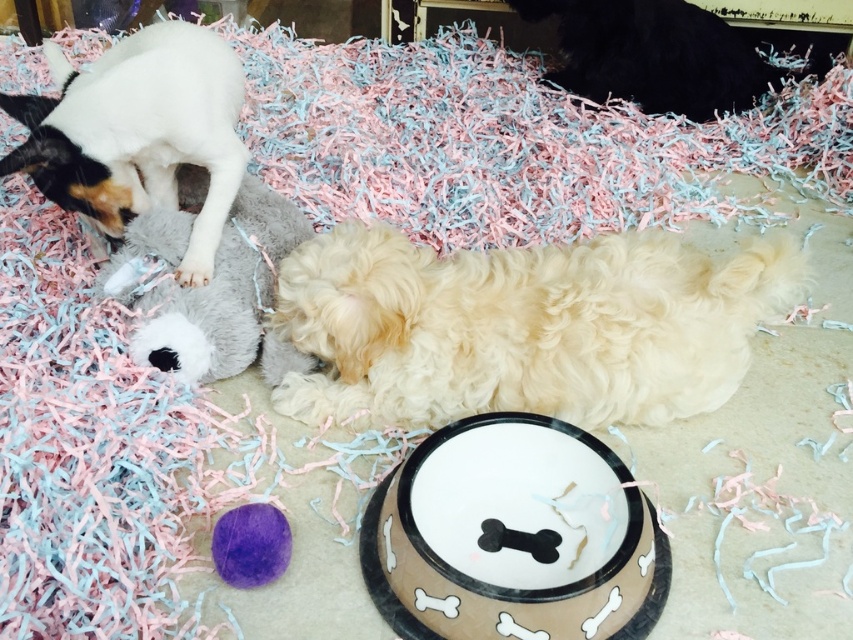
Who is more distant from viewer, (357, 340) or (578, 518)?

The point (357, 340) is behind.

Which is in front, point (610, 339) or point (372, 540)?

Point (372, 540) is in front.

Which is behind, point (347, 358) or point (509, 582)?

Positioned behind is point (347, 358).

You are a GUI agent. You are given a task and a screenshot of the screen. Output one action in this format:
    pyautogui.click(x=<x>, y=<y>)
    Task: Click on the white fluffy dog at center
    Image resolution: width=853 pixels, height=640 pixels.
    Given the screenshot: What is the action you would take?
    pyautogui.click(x=523, y=326)

This screenshot has height=640, width=853. What do you see at coordinates (514, 536) in the screenshot?
I see `brown ceramic bowl at center` at bounding box center [514, 536].

Is point (624, 616) in front of point (86, 84)?

Yes, point (624, 616) is closer to viewer.

Is point (462, 628) closer to camera compared to point (105, 60)?

Yes, point (462, 628) is closer to viewer.

The height and width of the screenshot is (640, 853). I want to click on brown ceramic bowl at center, so click(514, 536).

Between white soft plush toy at upper left and purple fuzzy ball at center, which one appears on the left side from the viewer's perspective?

From the viewer's perspective, white soft plush toy at upper left appears more on the left side.

Who is more forward, (144,144) or (253,573)?

Point (253,573) is in front.

Where is `white soft plush toy at upper left`? The image size is (853, 640). white soft plush toy at upper left is located at coordinates (140, 132).